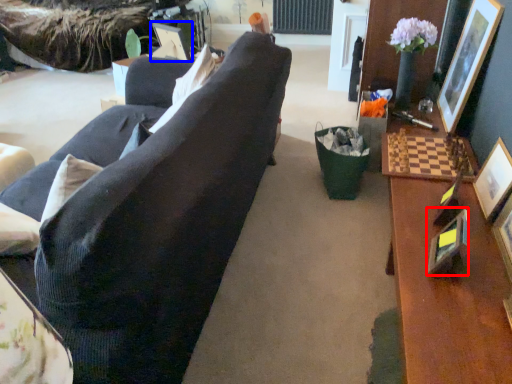
Question: Among these objects, which one is nearest to the camera, picture frame (highlighted by a red box) or picture frame (highlighted by a blue box)?

Choices:
 (A) picture frame
 (B) picture frame

Answer: (A)